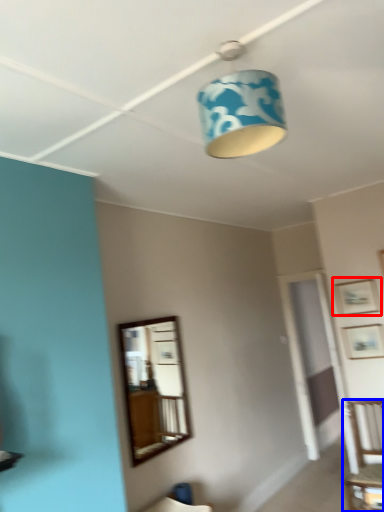
Question: Which object appears closest to the camera in this image, picture frame (highlighted by a red box) or furniture (highlighted by a blue box)?

Choices:
 (A) picture frame
 (B) furniture

Answer: (B)